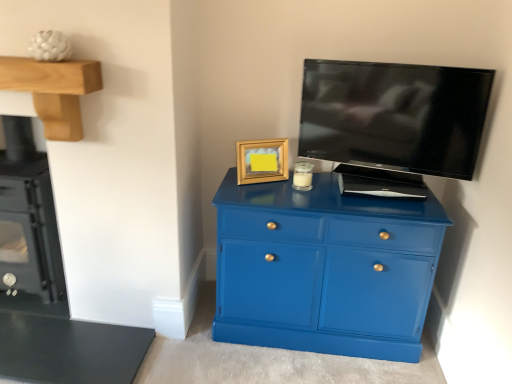
Question: Is black glass stove at left spatially inside black glossy tv at upper right, or outside of it?

Choices:
 (A) outside
 (B) inside

Answer: (A)

Question: In the image, is black glass stove at left on the left side or the right side of black glossy tv at upper right?

Choices:
 (A) left
 (B) right

Answer: (A)

Question: Based on their relative distances, which object is farther from the black glass stove at left?

Choices:
 (A) glossy blue cabinet at center
 (B) black glossy tv at upper right
 (C) wooden mantel at upper left
 (D) gold wooden picture frame at upper center
 (E) translucent glass candle at center

Answer: (B)

Question: Estimate the real-world distances between objects in this image. Which object is closer to the wooden mantel at upper left?

Choices:
 (A) black glass stove at left
 (B) translucent glass candle at center
 (C) black glossy tv at upper right
 (D) gold wooden picture frame at upper center
 (E) glossy blue cabinet at center

Answer: (A)